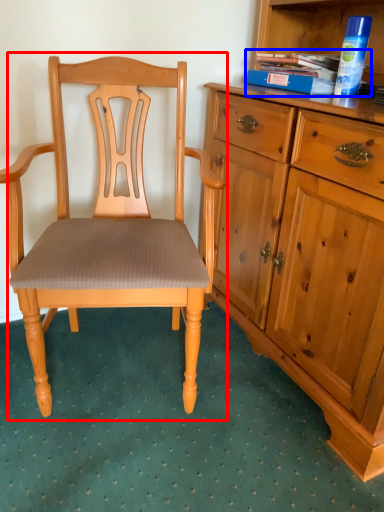
Question: Which object is closer to the camera taking this photo, chair (highlighted by a red box) or book (highlighted by a blue box)?

Choices:
 (A) chair
 (B) book

Answer: (A)